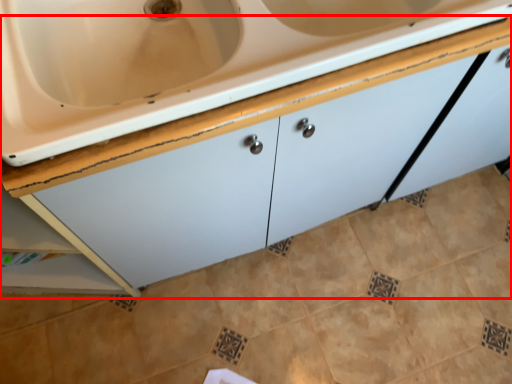
Question: From the image's perspective, where is cabinetry (annotated by the red box) located in relation to ceramic tile in the image?

Choices:
 (A) below
 (B) above

Answer: (B)